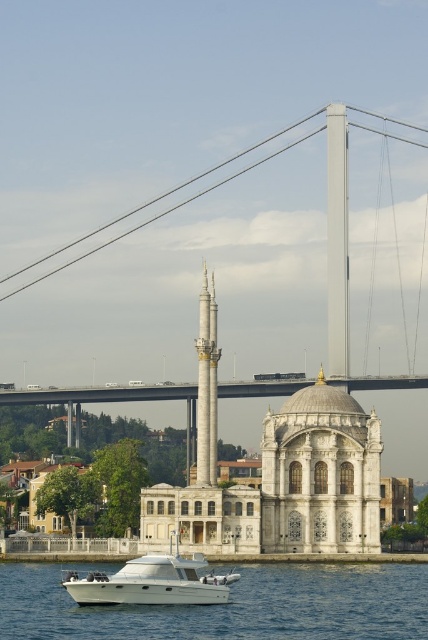
Question: Is white glossy water at lower center wider than metallic gray suspension bridge at upper center?

Choices:
 (A) yes
 (B) no

Answer: (B)

Question: Does white glossy water at lower center come in front of white glossy boat at lower center?

Choices:
 (A) yes
 (B) no

Answer: (A)

Question: Which point is closer to the camera?

Choices:
 (A) white glossy boat at lower center
 (B) white glossy water at lower center

Answer: (B)

Question: Estimate the real-world distances between objects in this image. Which object is closer to the metallic gray suspension bridge at upper center?

Choices:
 (A) white glossy boat at lower center
 (B) white glossy water at lower center

Answer: (B)

Question: Which of the following is the farthest from the observer?

Choices:
 (A) (252, 548)
 (B) (67, 572)
 (C) (314, 632)

Answer: (B)

Question: From the image, what is the correct spatial relationship of white glossy water at lower center in relation to white glossy boat at lower center?

Choices:
 (A) right
 (B) left

Answer: (A)